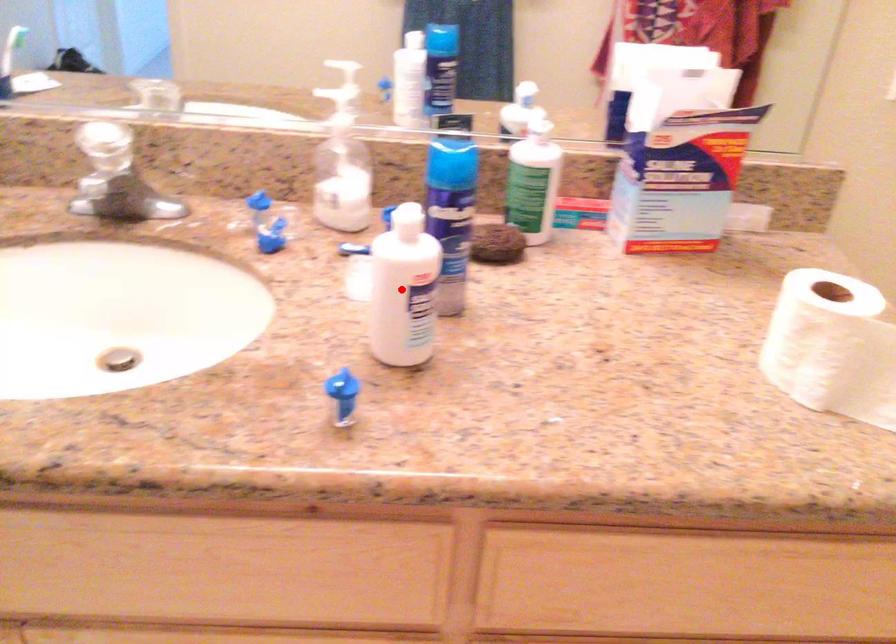
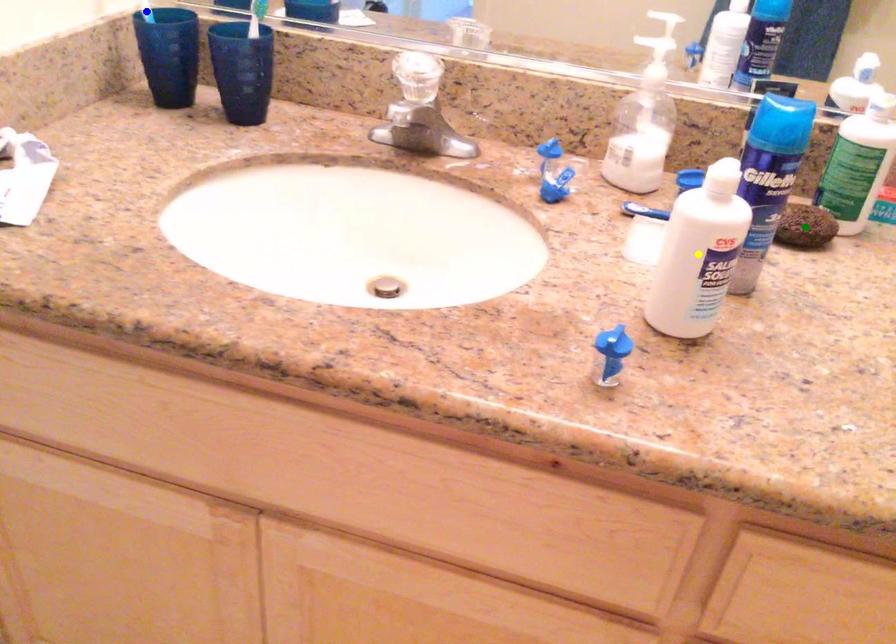
Question: I am providing you with two images of the same scene from different viewpoints. A red point is marked on the first image. You are given multiple points on the second image. Which mark in image 2 goes with the point in image 1?

Choices:
 (A) yellow point
 (B) blue point
 (C) green point

Answer: (A)